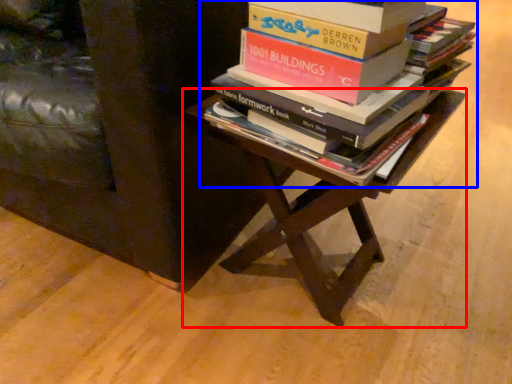
Question: Which of the following is the farthest to the observer, table (highlighted by a red box) or book (highlighted by a blue box)?

Choices:
 (A) table
 (B) book

Answer: (A)